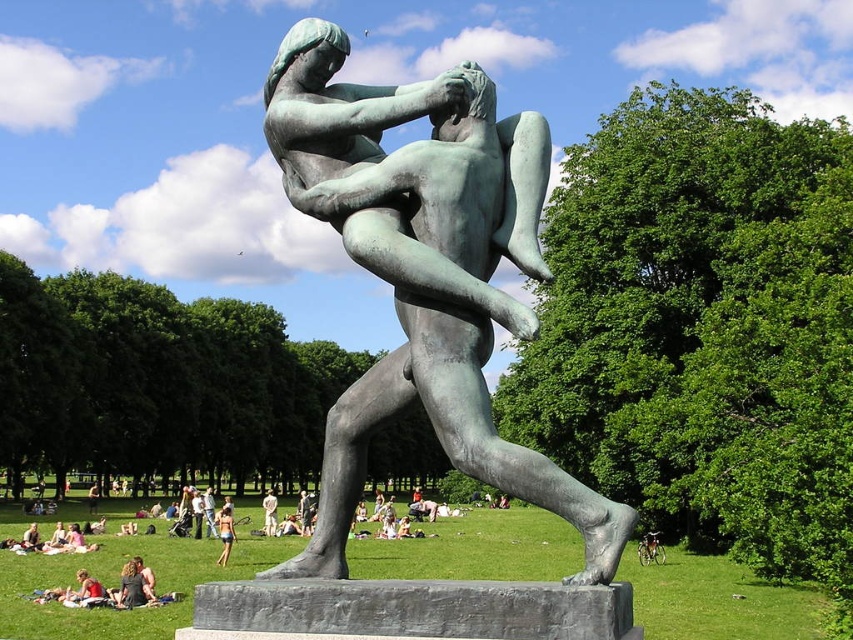
You are an art student who has just arrived at the park to sketch the bronze sculpture. You notice the matte black dress at lower left. Where exactly is the matte black dress located in relation to the sculpture?

The matte black dress at lower left is located at point (132, 586) relative to the sculpture.

You are an artist planning to create a miniature version of the sculpture in the park. You have a limited amount of bronze material. Which object between the matte black dress at lower left and the light brown wood man at center would require less bronze to recreate?

The matte black dress at lower left requires less bronze to recreate since it has a smaller size compared to the light brown wood man at center.

You are an artist visiting a park and see the matte black dress at lower left and the light brown wood man at center. Which object is located to the right of the other?

The matte black dress at lower left is positioned on the right side of light brown wood man at center, so the matte black dress at lower left is to the right of the light brown wood man at center.